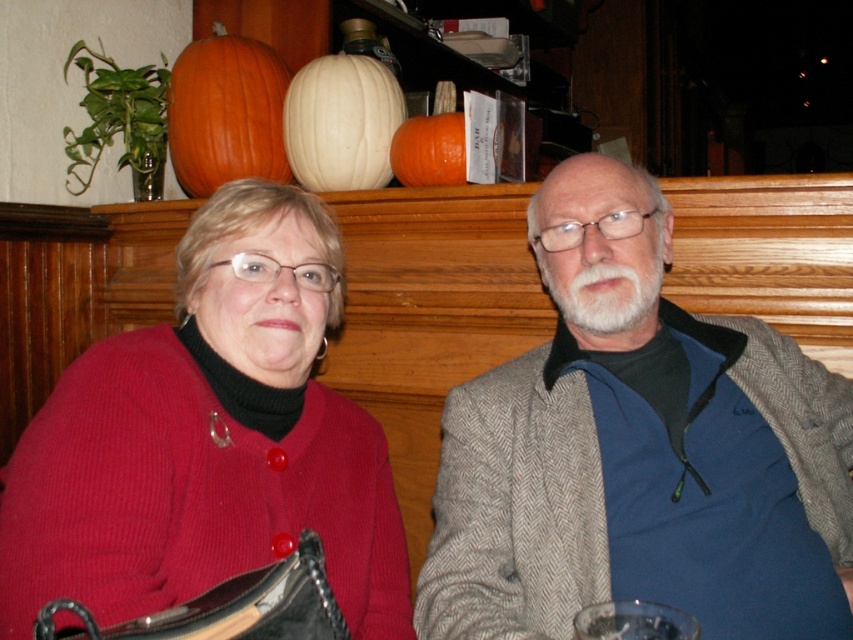
Is knitted red sweater at left positioned at the back of orange matte pumpkin at upper left?

That is False.

Is point (39, 442) less distant than point (170, 140)?

Yes, it is in front of point (170, 140).

Where is `knitted red sweater at left`? The width and height of the screenshot is (853, 640). knitted red sweater at left is located at coordinates (209, 440).

Can you confirm if white matte pumpkin at upper center is bigger than orange matte pumpkin at center?

Yes.

Who is more forward, (286, 97) or (444, 177)?

Point (444, 177) is more forward.

Find the location of a particular element. This screenshot has width=853, height=640. white matte pumpkin at upper center is located at coordinates (341, 122).

Locate an element on the screen. This screenshot has width=853, height=640. white matte pumpkin at upper center is located at coordinates (341, 122).

Can you confirm if blue woolen sweater at right is shorter than knitted red sweater at left?

In fact, blue woolen sweater at right may be taller than knitted red sweater at left.

Is point (836, 381) positioned in front of point (387, 612)?

No, (836, 381) is behind (387, 612).

Locate an element on the screen. blue woolen sweater at right is located at coordinates (636, 449).